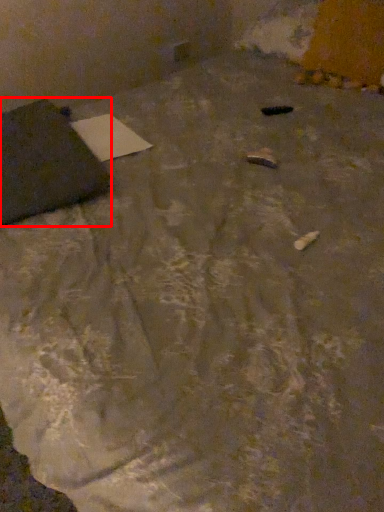
Question: From the image's perspective, where is furniture (annotated by the red box) located relative to notepad?

Choices:
 (A) below
 (B) above

Answer: (A)